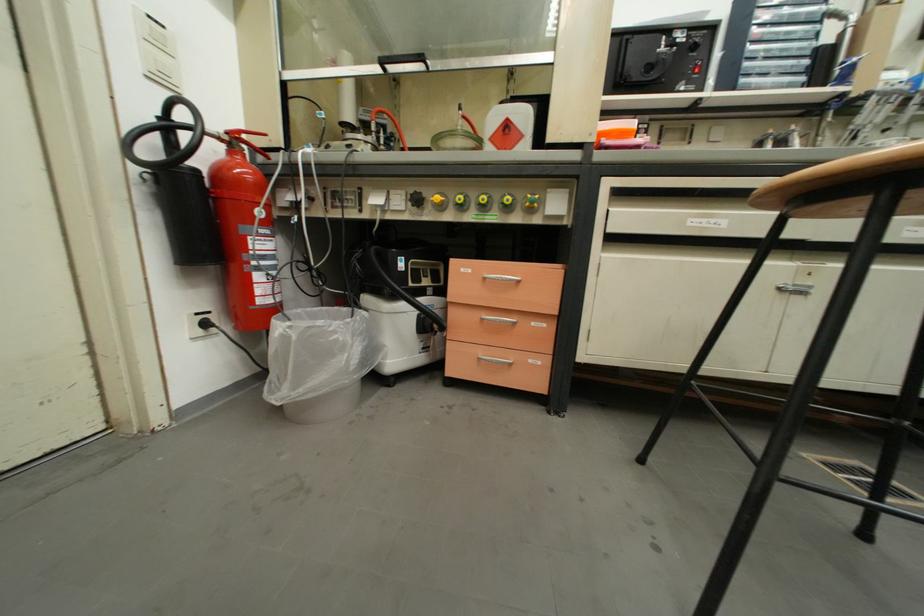
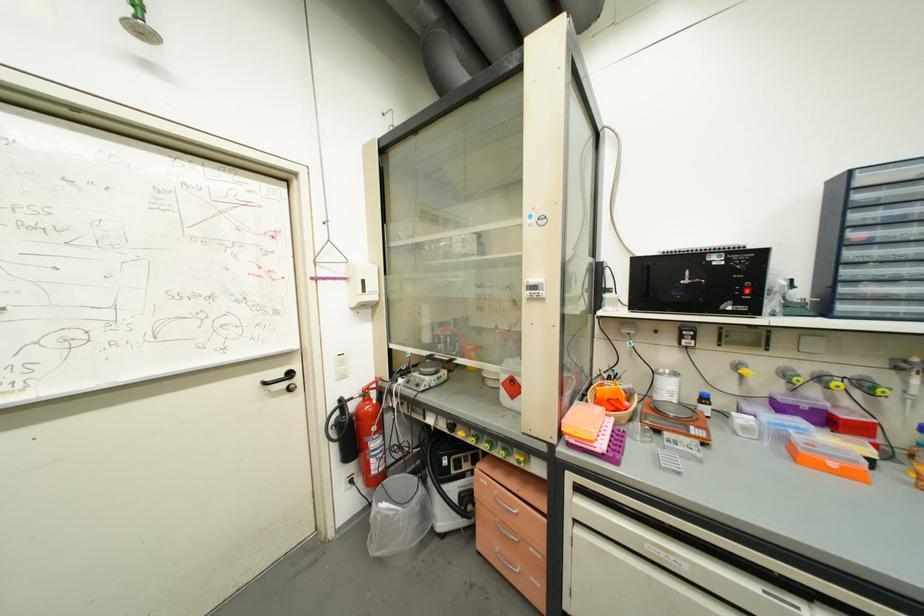
Locate, in the second image, the point that corresponds to (x=664, y=50) in the first image.

(688, 282)